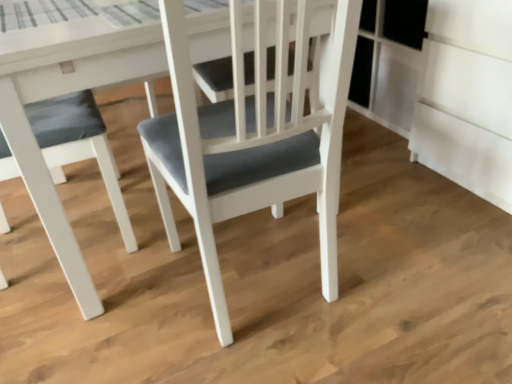
What do you see at coordinates (251, 141) in the screenshot?
I see `matte white chair at center` at bounding box center [251, 141].

At what (x,y) coordinates should I click in order to perform the action: click on matte white chair at center. Please return your answer as a coordinate pair (x, y). This screenshot has height=384, width=512. Looking at the image, I should click on (251, 141).

At what (x,y) coordinates should I click in order to perform the action: click on matte white chair at center. Please return your answer as a coordinate pair (x, y). The height and width of the screenshot is (384, 512). Looking at the image, I should click on (251, 141).